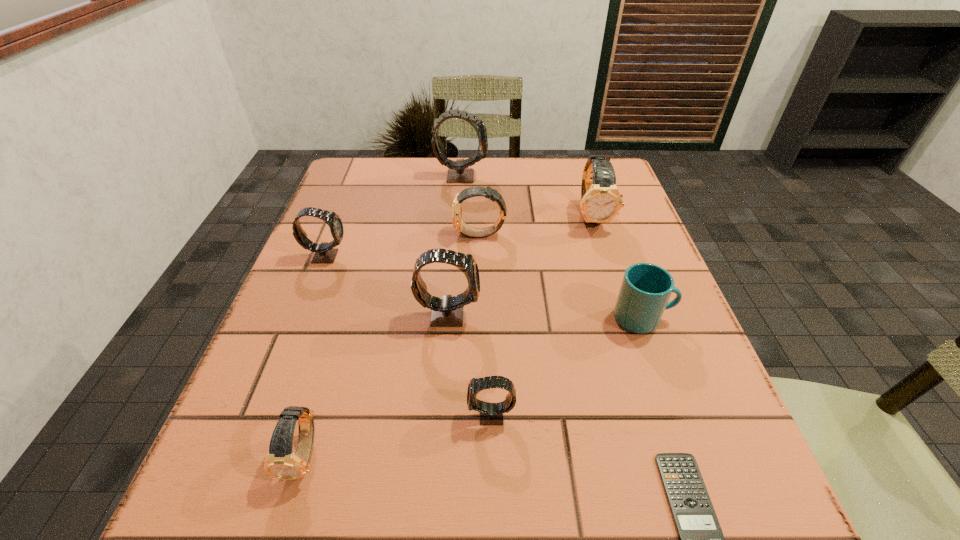
Find the location of a particular element. The height and width of the screenshot is (540, 960). the farthest watch is located at coordinates (458, 172).

The height and width of the screenshot is (540, 960). In order to click on the tallest object in this screenshot , I will do `click(458, 172)`.

Identify the location of the second biggest gray watch. The image size is (960, 540). (447, 311).

I want to click on the third nearest watch, so click(447, 311).

Image resolution: width=960 pixels, height=540 pixels. What are the coordinates of `the rightmost watch` in the screenshot? It's located at (601, 201).

Where is `the biggest gold watch`? This screenshot has width=960, height=540. the biggest gold watch is located at coordinates (601, 201).

Where is `the second gold watch from left to right`? the second gold watch from left to right is located at coordinates (492, 194).

Identify the location of the fourth farthest object. Image resolution: width=960 pixels, height=540 pixels. (325, 252).

This screenshot has height=540, width=960. I want to click on the fourth farthest watch, so click(325, 252).

Where is `cup`? This screenshot has width=960, height=540. cup is located at coordinates (646, 288).